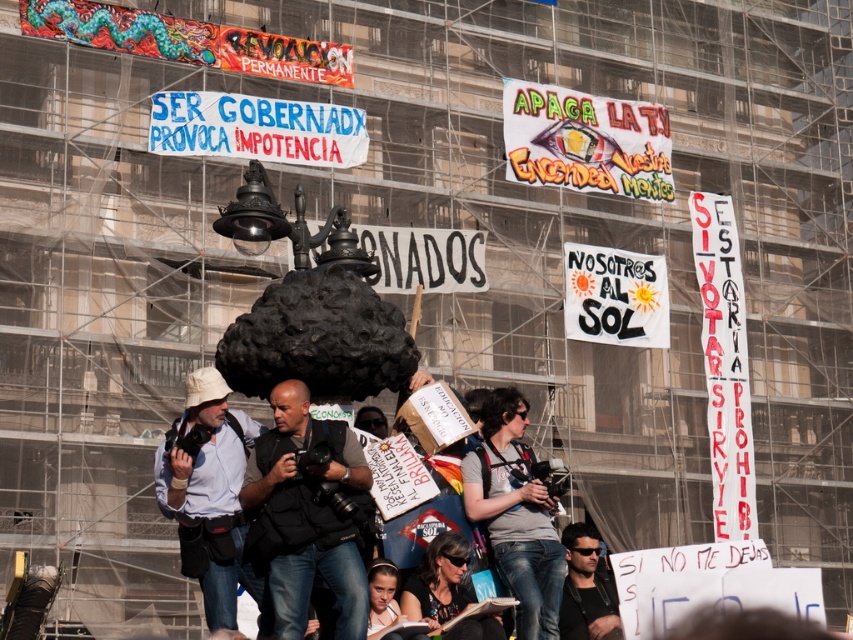
Can you confirm if white matte shirt at lower left is positioned below dark hair at center?

Incorrect, white matte shirt at lower left is not positioned below dark hair at center.

Who is taller, white matte shirt at lower left or dark hair at center?

Standing taller between the two is white matte shirt at lower left.

Is point (161, 456) behind point (589, 566)?

No, it is not.

Image resolution: width=853 pixels, height=640 pixels. What are the coordinates of `white matte shirt at lower left` in the screenshot? It's located at (209, 493).

This screenshot has width=853, height=640. I want to click on dark gray vest at center, so click(x=305, y=515).

Who is lower down, dark gray vest at center or white matte shirt at lower left?

white matte shirt at lower left is below.

This screenshot has height=640, width=853. In order to click on dark gray vest at center in this screenshot , I will do `click(305, 515)`.

Does dark gray vest at center lie in front of dark hair at center?

Yes, dark gray vest at center is closer to the viewer.

Does dark gray vest at center have a lesser height compared to dark hair at center?

No, dark gray vest at center is not shorter than dark hair at center.

Describe the element at coordinates (305, 515) in the screenshot. I see `dark gray vest at center` at that location.

At what (x,y) coordinates should I click in order to perform the action: click on dark gray vest at center. Please return your answer as a coordinate pair (x, y). The width and height of the screenshot is (853, 640). Looking at the image, I should click on (305, 515).